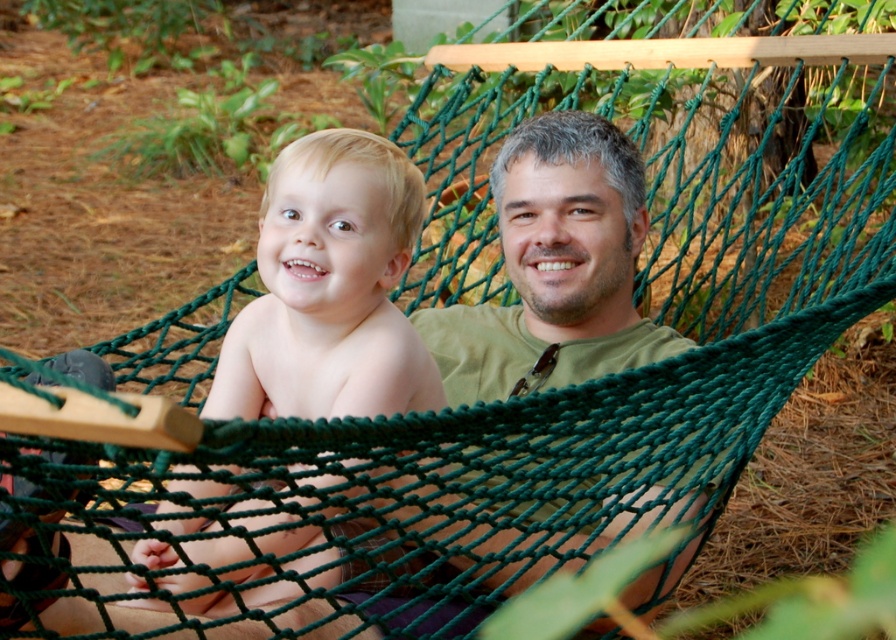
Question: Does green fabric hammock at center have a greater width compared to blonde hair baby at center?

Choices:
 (A) yes
 (B) no

Answer: (A)

Question: Can you confirm if green fabric hammock at center is wider than blonde hair baby at center?

Choices:
 (A) yes
 (B) no

Answer: (A)

Question: In this image, where is green fabric hammock at center located relative to blonde hair baby at center?

Choices:
 (A) left
 (B) right

Answer: (A)

Question: Which object appears farthest from the camera in this image?

Choices:
 (A) blonde hair baby at center
 (B) green fabric hammock at center

Answer: (A)